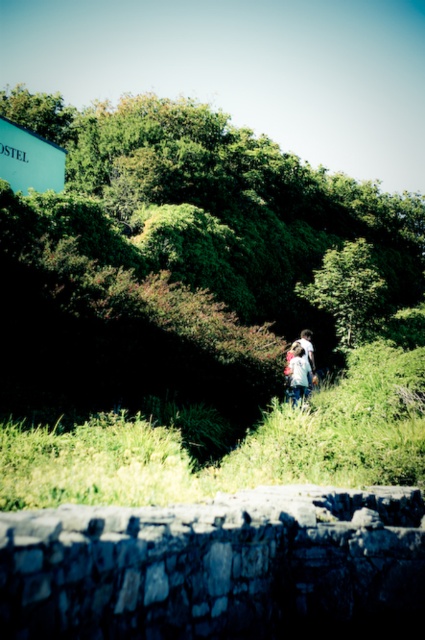
Question: Considering the relative positions of green painted signboard at upper left and white matte jacket at center in the image provided, where is green painted signboard at upper left located with respect to white matte jacket at center?

Choices:
 (A) below
 (B) above

Answer: (B)

Question: Which of the following is the closest to the observer?

Choices:
 (A) (300, 337)
 (B) (294, 355)
 (C) (2, 141)

Answer: (B)

Question: Does white matte jacket at center appear on the right side of white cotton shirt at center?

Choices:
 (A) yes
 (B) no

Answer: (B)

Question: Is green painted signboard at upper left wider than white matte jacket at center?

Choices:
 (A) no
 (B) yes

Answer: (B)

Question: Which point is closer to the camera?

Choices:
 (A) (303, 368)
 (B) (62, 163)

Answer: (A)

Question: Which object is positioned farthest from the white cotton shirt at center?

Choices:
 (A) white matte jacket at center
 (B) green painted signboard at upper left

Answer: (B)